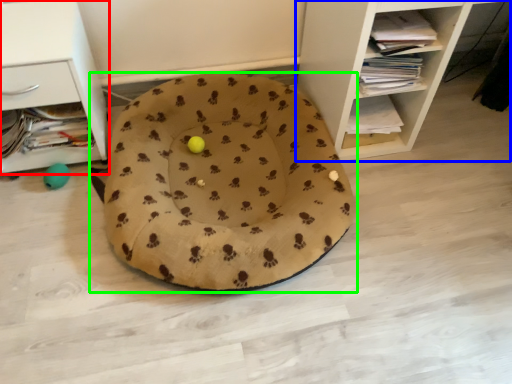
Question: Considering the real-world distances, which object is farthest from shelf (highlighted by a red box)? shelf (highlighted by a blue box) or dog bed (highlighted by a green box)?

Choices:
 (A) shelf
 (B) dog bed

Answer: (A)